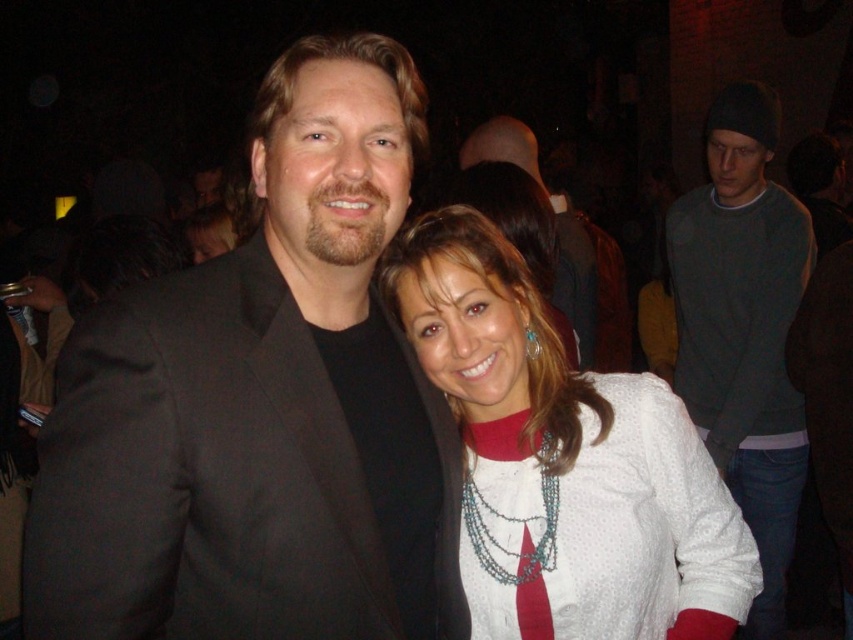
Can you confirm if black matte suit at center is wider than dark gray sweater at right?

Indeed, black matte suit at center has a greater width compared to dark gray sweater at right.

Is black matte suit at center positioned at the back of dark gray sweater at right?

No, it is in front of dark gray sweater at right.

Is point (299, 301) behind point (764, 244)?

That is False.

You are a GUI agent. You are given a task and a screenshot of the screen. Output one action in this format:
    pyautogui.click(x=<x>, y=<y>)
    Task: Click on the black matte suit at center
    
    Given the screenshot: What is the action you would take?
    pyautogui.click(x=260, y=406)

Between point (761, 161) and point (465, 481), which one is positioned behind?

The point (761, 161) is behind.

Who is more distant from viewer, (769, 305) or (550, 536)?

Positioned behind is point (769, 305).

Identify the location of dark gray sweater at right. Image resolution: width=853 pixels, height=640 pixels. (744, 328).

Which is behind, point (554, 547) or point (589, 314)?

The point (589, 314) is more distant.

Which is above, teal beaded necklace at center or matte black suit at center?

matte black suit at center is higher up.

Does point (486, 449) come closer to viewer compared to point (527, 154)?

Yes, point (486, 449) is in front of point (527, 154).

The width and height of the screenshot is (853, 640). What are the coordinates of `teal beaded necklace at center` in the screenshot? It's located at (515, 522).